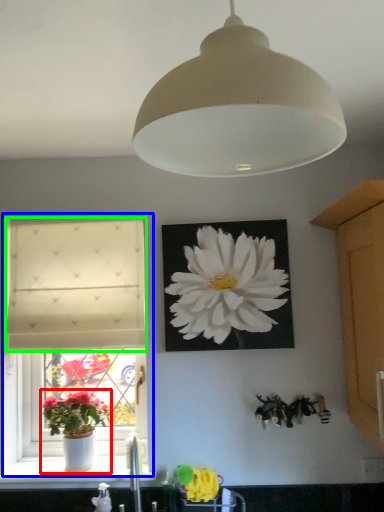
Question: Considering the real-world distances, which object is farthest from houseplant (highlighted by a red box)? window (highlighted by a blue box) or curtain (highlighted by a green box)?

Choices:
 (A) window
 (B) curtain

Answer: (B)